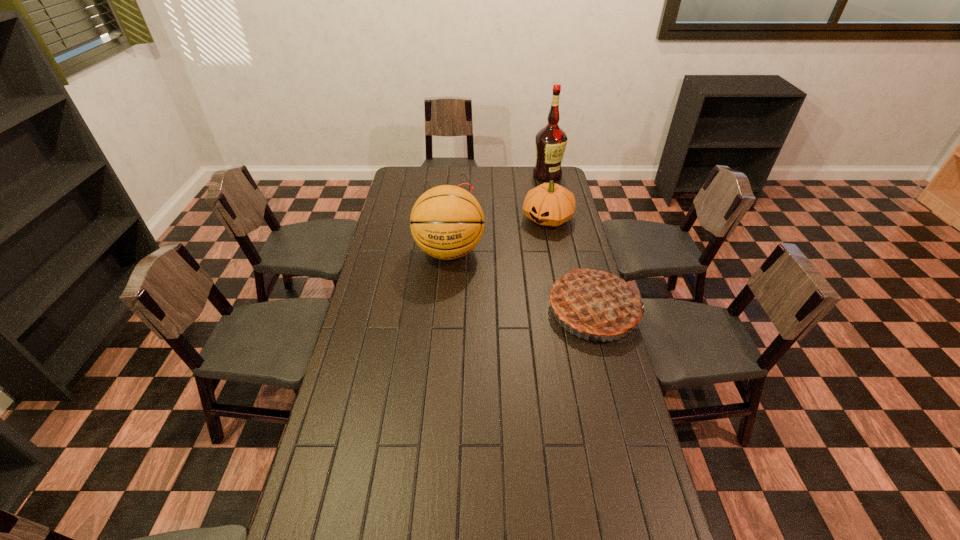
I want to click on basketball, so click(447, 222).

You are a GUI agent. You are given a task and a screenshot of the screen. Output one action in this format:
    pyautogui.click(x=<x>, y=<y>)
    Task: Click on the nearest object
    
    Given the screenshot: What is the action you would take?
    pyautogui.click(x=595, y=302)

You are a GUI agent. You are given a task and a screenshot of the screen. Output one action in this format:
    pyautogui.click(x=<x>, y=<y>)
    Task: Click on the pie
    
    Given the screenshot: What is the action you would take?
    pyautogui.click(x=595, y=302)

Locate an element on the screen. alcohol is located at coordinates (550, 141).

Where is `gourd`? gourd is located at coordinates (549, 204).

Find the location of `spectacles`. spectacles is located at coordinates (462, 174).

The width and height of the screenshot is (960, 540). Find the location of `vacant space located on the surface of the basketball near the brand logo`. vacant space located on the surface of the basketball near the brand logo is located at coordinates (444, 313).

This screenshot has height=540, width=960. What are the coordinates of `vacant position located 0.290m on the front of the pie` in the screenshot? It's located at (623, 423).

In order to click on vacant space situated on the label of the alcohol in this screenshot , I will do `click(538, 216)`.

At what (x,y) coordinates should I click in order to perform the action: click on blank space located 0.150m on the label of the alcohol. Please return your answer as a coordinate pair (x, y). Image resolution: width=960 pixels, height=540 pixels. Looking at the image, I should click on (542, 198).